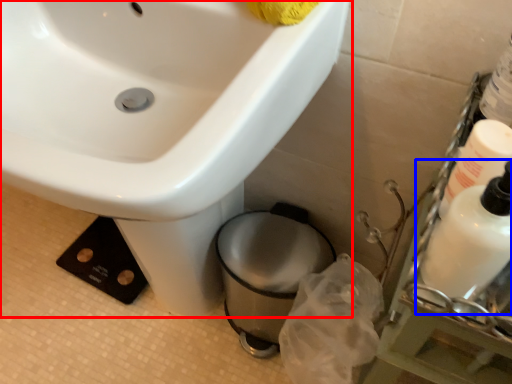
Question: Which object is further to the camera taking this photo, sink (highlighted by a red box) or cleaning product (highlighted by a blue box)?

Choices:
 (A) sink
 (B) cleaning product

Answer: (A)